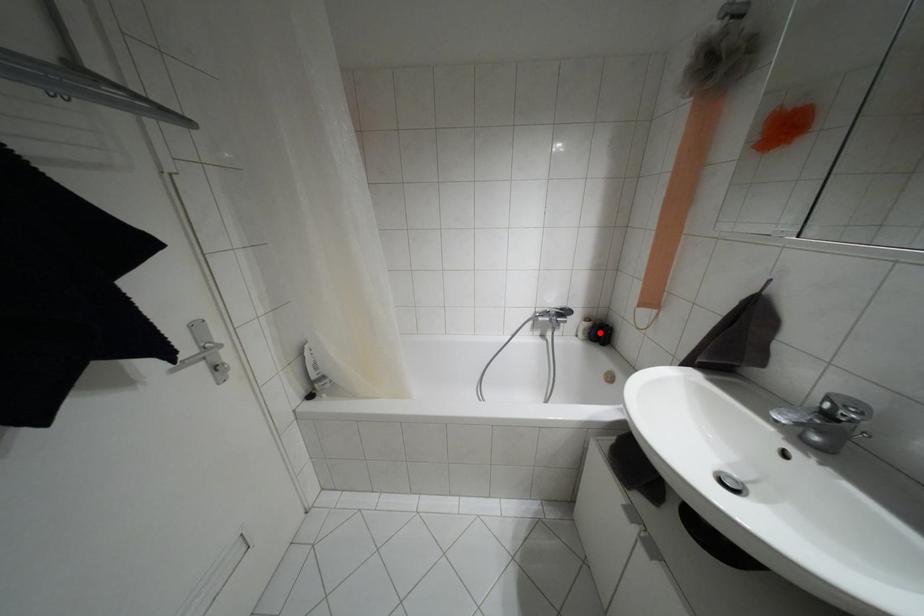
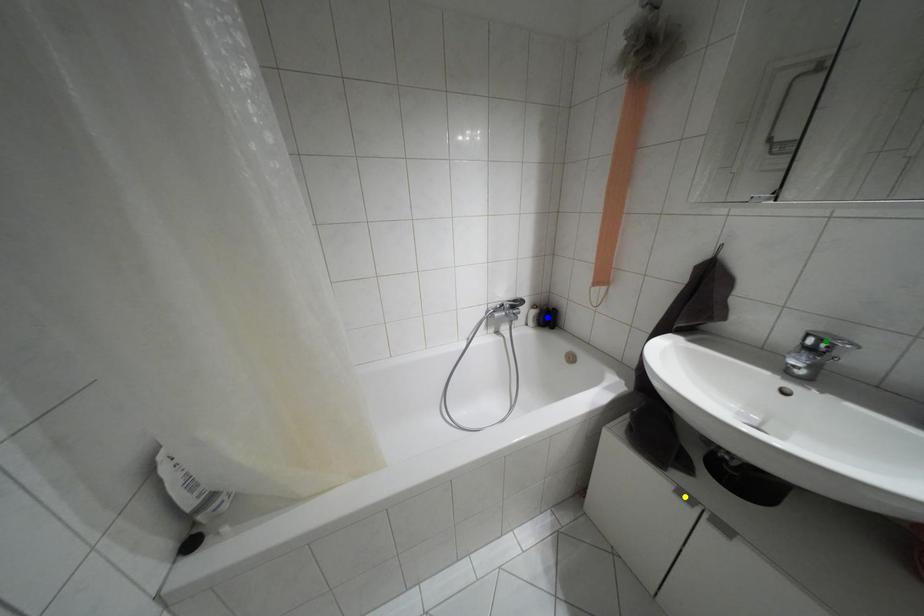
Question: I am providing you with two images of the same scene from different viewpoints. A red point is marked on the first image. You are given multiple points on the second image. Can you choose the point in image 2 that corresponds to the point in image 1?

Choices:
 (A) yellow point
 (B) green point
 (C) blue point

Answer: (C)